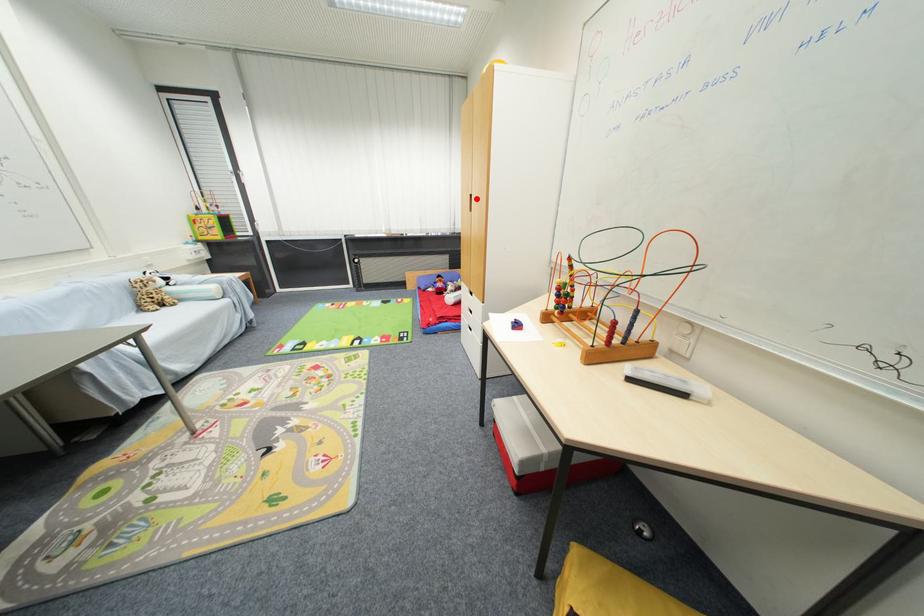
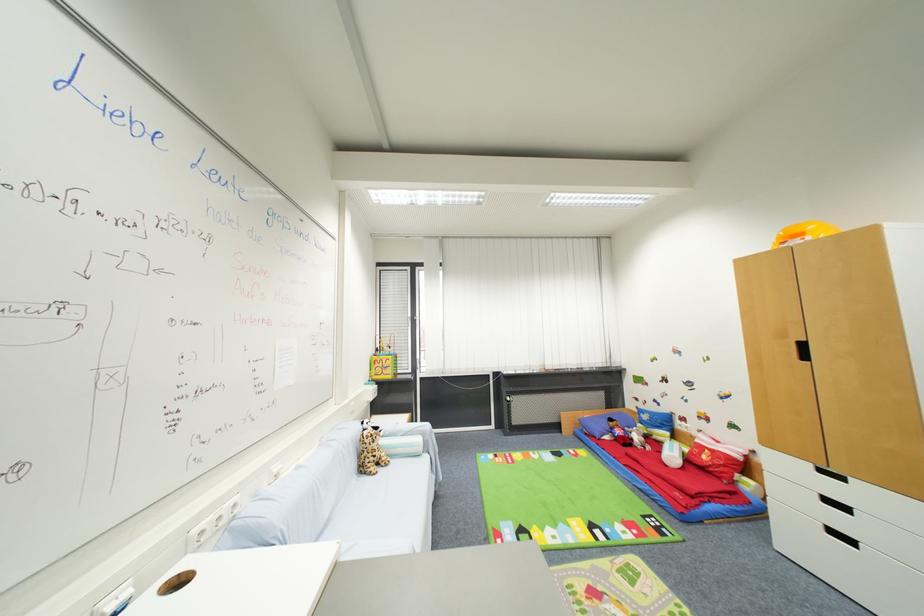
In the second image, find the point that corresponds to the highlighted location in the first image.

(808, 346)